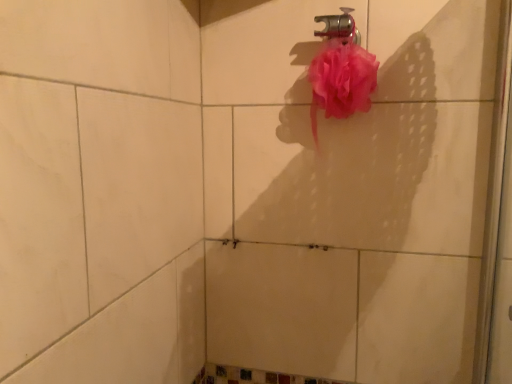
Question: Considering the relative positions of pink mesh sponge at upper right and metallic faucet at upper center in the image provided, is pink mesh sponge at upper right to the right of metallic faucet at upper center from the viewer's perspective?

Choices:
 (A) no
 (B) yes

Answer: (B)

Question: Does pink mesh sponge at upper right have a lesser width compared to metallic faucet at upper center?

Choices:
 (A) no
 (B) yes

Answer: (A)

Question: Is pink mesh sponge at upper right facing away from metallic faucet at upper center?

Choices:
 (A) yes
 (B) no

Answer: (B)

Question: Is pink mesh sponge at upper right bigger than metallic faucet at upper center?

Choices:
 (A) yes
 (B) no

Answer: (A)

Question: Can you confirm if pink mesh sponge at upper right is shorter than metallic faucet at upper center?

Choices:
 (A) yes
 (B) no

Answer: (B)

Question: Is pink mesh sponge at upper right to the left of metallic faucet at upper center from the viewer's perspective?

Choices:
 (A) no
 (B) yes

Answer: (A)

Question: Is metallic faucet at upper center smaller than pink mesh sponge at upper right?

Choices:
 (A) yes
 (B) no

Answer: (A)

Question: Is metallic faucet at upper center closer to camera compared to pink mesh sponge at upper right?

Choices:
 (A) no
 (B) yes

Answer: (A)

Question: Can you confirm if metallic faucet at upper center is bigger than pink mesh sponge at upper right?

Choices:
 (A) no
 (B) yes

Answer: (A)

Question: From a real-world perspective, is metallic faucet at upper center on top of pink mesh sponge at upper right?

Choices:
 (A) no
 (B) yes

Answer: (B)

Question: Is pink mesh sponge at upper right surrounded by metallic faucet at upper center?

Choices:
 (A) no
 (B) yes

Answer: (A)

Question: Considering the relative sizes of metallic faucet at upper center and pink mesh sponge at upper right in the image provided, is metallic faucet at upper center taller than pink mesh sponge at upper right?

Choices:
 (A) yes
 (B) no

Answer: (B)

Question: Is pink mesh sponge at upper right in front of or behind metallic faucet at upper center in the image?

Choices:
 (A) front
 (B) behind

Answer: (A)